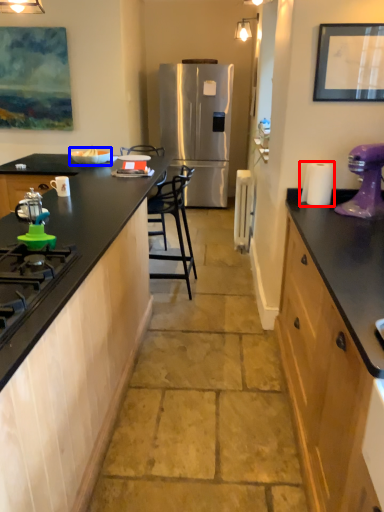
Question: Which of the following is the farthest to the observer, paper towel (highlighted by a red box) or appliance (highlighted by a blue box)?

Choices:
 (A) paper towel
 (B) appliance

Answer: (B)